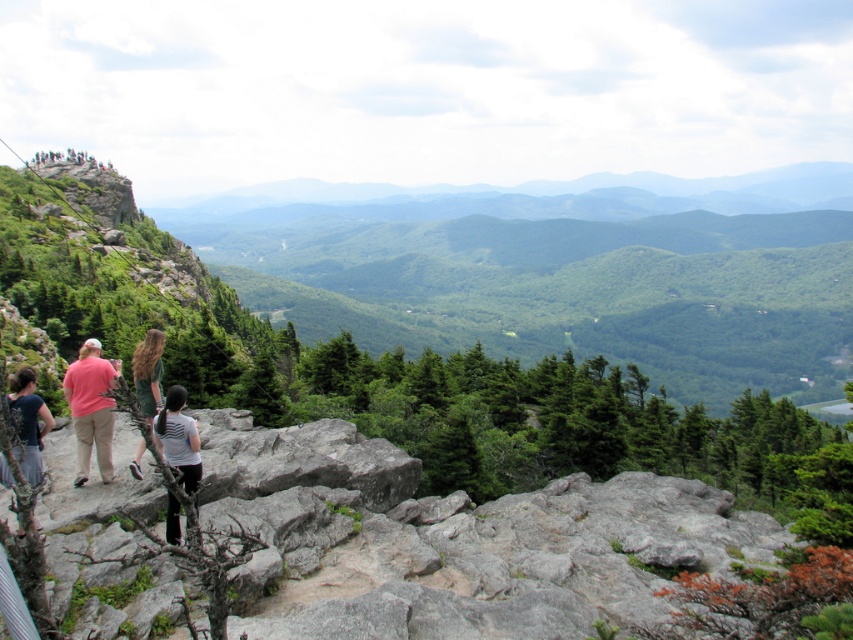
Question: Which is farther from the green fabric dress at center?

Choices:
 (A) matte pink shirt at left
 (B) matte gray shirt at lower left

Answer: (B)

Question: Estimate the real-world distances between objects in this image. Which object is farther from the matte gray shirt at lower left?

Choices:
 (A) green fabric dress at center
 (B) white matte shirt at center

Answer: (A)

Question: From the image, what is the correct spatial relationship of white matte shirt at center in relation to green fabric dress at center?

Choices:
 (A) right
 (B) left

Answer: (A)

Question: From the image, what is the correct spatial relationship of matte pink shirt at left in relation to matte gray shirt at lower left?

Choices:
 (A) below
 (B) above

Answer: (B)

Question: Considering the relative positions of matte pink shirt at left and matte gray shirt at lower left in the image provided, where is matte pink shirt at left located with respect to matte gray shirt at lower left?

Choices:
 (A) above
 (B) below

Answer: (A)

Question: Among these points, which one is nearest to the camera?

Choices:
 (A) (80, 376)
 (B) (192, 419)
 (C) (36, 449)
 (D) (134, 474)

Answer: (B)